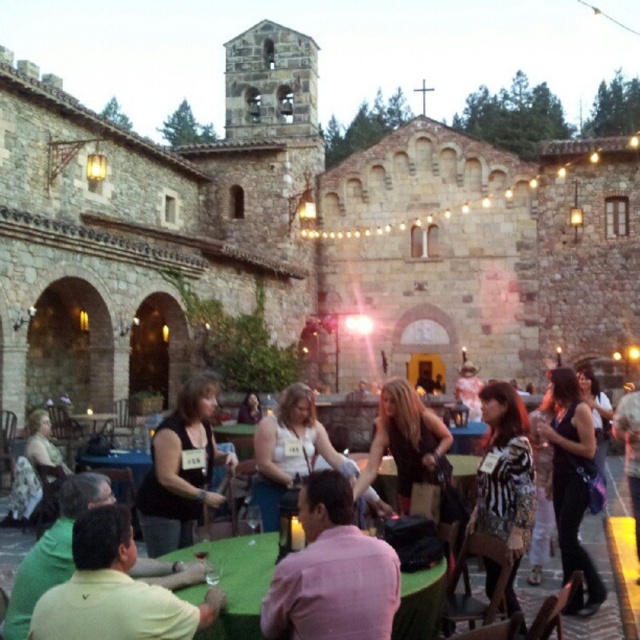
You are a photographer at this event and want to capture both the green fabric table at center and the shiny black dress at center in a single shot. Given that your camera has a fixed focal length, which object should you prioritize positioning closer to the camera to ensure both are in focus?

The green fabric table at center is larger in size than the shiny black dress at center, so positioning the green fabric table at center closer to the camera will help ensure both are in focus due to its larger size requiring more depth of field.

You are standing at the entrance of the historic stone building and want to find the green fabric table at center. Based on the coordinates provided, which direction should you look to locate it?

The green fabric table at center is located at coordinates point (237, 580), so you should look towards the center of the scene to find it.